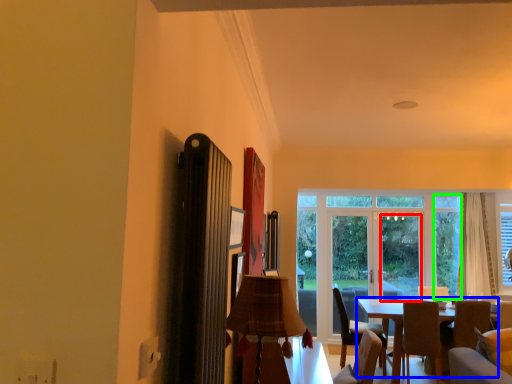
Question: Which object is positioned farthest from window screen (highlighted by a red box)? Select from table (highlighted by a blue box) and window (highlighted by a green box).

Choices:
 (A) table
 (B) window

Answer: (A)